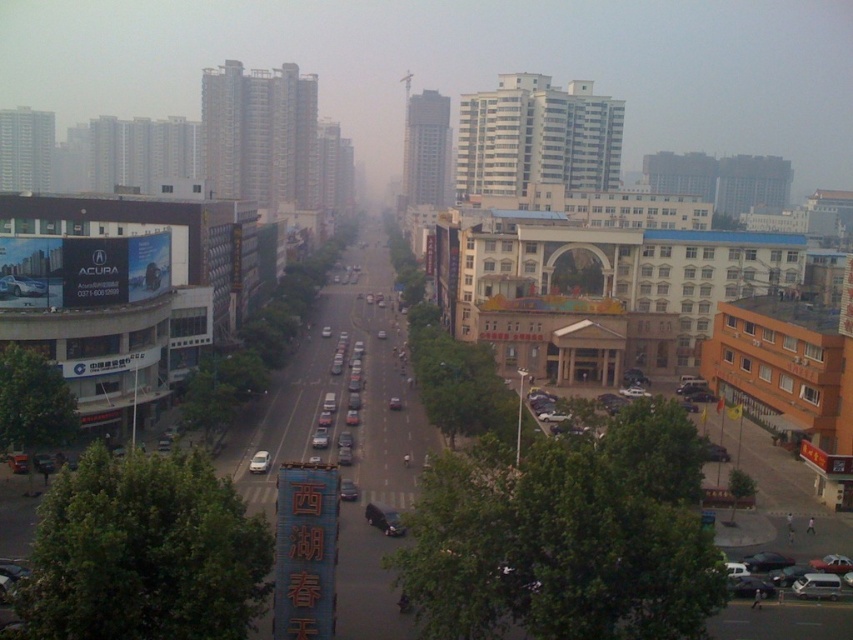
Question: Estimate the real-world distances between objects in this image. Which object is farther from the shiny black car at center?

Choices:
 (A) matte black car at center
 (B) silver metallic sedan at lower right

Answer: (B)

Question: Does silver metallic sedan at lower right have a larger size compared to shiny black car at center?

Choices:
 (A) yes
 (B) no

Answer: (A)

Question: Can you confirm if matte black car at left is wider than shiny black car at center?

Choices:
 (A) no
 (B) yes

Answer: (B)

Question: Based on their relative distances, which object is farther from the matte black car at center?

Choices:
 (A) silver metallic sedan at lower right
 (B) satin silver sedan at center
 (C) shiny black car at center

Answer: (A)

Question: Is shiny black car at center further to the viewer compared to matte black car at center?

Choices:
 (A) yes
 (B) no

Answer: (A)

Question: Which of the following is the farthest from the observer?

Choices:
 (A) (819, 579)
 (B) (21, 292)
 (C) (265, 467)

Answer: (C)